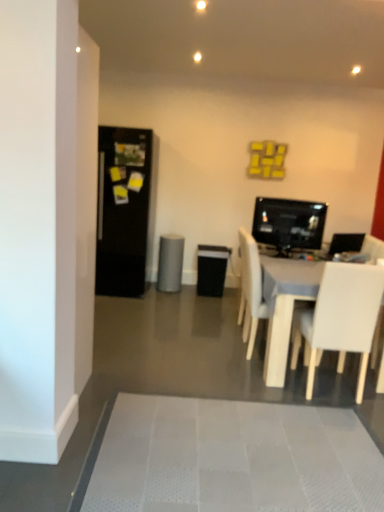
Locate an element on the screen. The width and height of the screenshot is (384, 512). black matte refrigerator at left is located at coordinates (124, 209).

What is the approximate width of black matte refrigerator at left?

black matte refrigerator at left is 31.75 inches in width.

Measure the distance between point (x=282, y=273) and camera.

The distance of point (x=282, y=273) from camera is 3.00 meters.

At what (x,y) coordinates should I click in order to perform the action: click on gray matte speaker at center. Please return your answer as a coordinate pair (x, y). The height and width of the screenshot is (512, 384). Looking at the image, I should click on (170, 263).

In order to face white matte chair at center, the second chair viewed from the front, should I rotate leftwards or rightwards?

To face it directly, rotate right by 11.208 degrees.

Locate an element on the screen. This screenshot has width=384, height=512. white textured bath mat at lower center is located at coordinates (229, 458).

Find the location of a particular element. matte black monitor at center right is located at coordinates (288, 225).

What do you see at coordinates (340, 319) in the screenshot? I see `white matte chair at lower right, acting as the 2th chair starting from the back` at bounding box center [340, 319].

Image resolution: width=384 pixels, height=512 pixels. Identify the location of black matte refrigerator at left. (124, 209).

Can you confirm if white plastic entertainment center at lower right is taller than white matte chair at lower right, marked as the first chair in a front-to-back arrangement?

No.

Can you confirm if white plastic entertainment center at lower right is wider than white matte chair at lower right, marked as the first chair in a front-to-back arrangement?

Yes.

Is white plastic entertainment center at lower right smaller than white matte chair at lower right, acting as the 2th chair starting from the back?

No, white plastic entertainment center at lower right is not smaller than white matte chair at lower right, acting as the 2th chair starting from the back.

From a real-world perspective, is black matte refrigerator at left located higher than white matte chair at lower right, marked as the first chair in a front-to-back arrangement?

Yes, from a real-world perspective, black matte refrigerator at left is above white matte chair at lower right, marked as the first chair in a front-to-back arrangement.

Is there a large distance between black matte refrigerator at left and white matte chair at lower right, acting as the 2th chair starting from the back?

Yes.

In terms of width, does black matte refrigerator at left look wider or thinner when compared to white matte chair at lower right, acting as the 2th chair starting from the back?

black matte refrigerator at left is wider than white matte chair at lower right, acting as the 2th chair starting from the back.

Which point is more distant from viewer, [357,264] or [263,230]?

The point [263,230] is farther.

Is white matte chair at lower right, acting as the 2th chair starting from the back, facing towards matte black monitor at center right?

Yes, white matte chair at lower right, acting as the 2th chair starting from the back, is facing matte black monitor at center right.

Who is more distant, white matte chair at lower right, marked as the first chair in a front-to-back arrangement, or matte black monitor at center right?

Positioned behind is matte black monitor at center right.

Is matte black monitor at center right placed right next to gray matte speaker at center?

matte black monitor at center right is not next to gray matte speaker at center, and they're not touching.

Is matte black monitor at center right thinner than gray matte speaker at center?

Yes.

What's the angular difference between matte black monitor at center right and gray matte speaker at center's facing directions?

14.7 degrees.

Can you confirm if matte black monitor at center right is bigger than gray matte speaker at center?

No, matte black monitor at center right is not bigger than gray matte speaker at center.

Is white plastic entertainment center at lower right inside or outside of black matte refrigerator at left?

white plastic entertainment center at lower right is outside black matte refrigerator at left.

From the picture: Who is smaller, white plastic entertainment center at lower right or black matte refrigerator at left?

Smaller between the two is black matte refrigerator at left.

Looking at this image, does white plastic entertainment center at lower right have a greater width compared to black matte refrigerator at left?

Yes, white plastic entertainment center at lower right is wider than black matte refrigerator at left.

Is white plastic entertainment center at lower right next to black matte refrigerator at left and touching it?

No, white plastic entertainment center at lower right is not making contact with black matte refrigerator at left.

Locate an element on the screen. The width and height of the screenshot is (384, 512). entertainment center on the right of white matte chair at center, the first chair when ordered from back to front is located at coordinates (285, 307).

Considering the sizes of white plastic entertainment center at lower right and white matte chair at center, the first chair when ordered from back to front, in the image, is white plastic entertainment center at lower right wider or thinner than white matte chair at center, the first chair when ordered from back to front,?

Clearly, white plastic entertainment center at lower right has more width compared to white matte chair at center, the first chair when ordered from back to front.

Looking at this image, is white plastic entertainment center at lower right spatially inside white matte chair at center, the second chair viewed from the front, or outside of it?

white plastic entertainment center at lower right is spatially situated outside white matte chair at center, the second chair viewed from the front.

Which of these two, white plastic entertainment center at lower right or white matte chair at center, the first chair when ordered from back to front, is bigger?

Bigger between the two is white plastic entertainment center at lower right.

Is white textured bath mat at lower center turned away from matte black monitor at center right?

white textured bath mat at lower center does not have its back to matte black monitor at center right.

Is point (271, 493) positioned after point (293, 234)?

No, (271, 493) is in front of (293, 234).

Looking at this image, is white textured bath mat at lower center at the right side of matte black monitor at center right?

In fact, white textured bath mat at lower center is to the left of matte black monitor at center right.

In the scene shown: From a real-world perspective, is white textured bath mat at lower center on matte black monitor at center right?

Actually, white textured bath mat at lower center is physically below matte black monitor at center right in the real world.

In order to click on chair in front of the white plastic entertainment center at lower right in this screenshot , I will do `click(340, 319)`.

Where is `the 2nd chair to the right of the black matte refrigerator at left, counting from the anchor's position`? The image size is (384, 512). the 2nd chair to the right of the black matte refrigerator at left, counting from the anchor's position is located at coordinates (340, 319).

Which object lies further to the anchor point white textured bath mat at lower center, matte black monitor at center right or white matte chair at center, the first chair when ordered from back to front?

matte black monitor at center right is further to white textured bath mat at lower center.

From the image, which object appears to be nearer to white matte chair at center, the second chair viewed from the front, matte black monitor at center right or white matte chair at lower right, marked as the first chair in a front-to-back arrangement?

Among the two, matte black monitor at center right is located nearer to white matte chair at center, the second chair viewed from the front.

From the image, which object appears to be farther from matte black monitor at center right, white matte chair at center, the second chair viewed from the front, or white matte chair at lower right, marked as the first chair in a front-to-back arrangement?

white matte chair at lower right, marked as the first chair in a front-to-back arrangement, is further to matte black monitor at center right.

Based on their spatial positions, is matte black monitor at center right or white plastic entertainment center at lower right closer to black matte refrigerator at left?

The object closer to black matte refrigerator at left is matte black monitor at center right.

Considering their positions, is white plastic entertainment center at lower right positioned further to gray matte speaker at center than matte black monitor at center right?

white plastic entertainment center at lower right.

Looking at the image, which one is located further to white matte chair at lower right, marked as the first chair in a front-to-back arrangement, white plastic entertainment center at lower right or white matte chair at center, the first chair when ordered from back to front?

white matte chair at center, the first chair when ordered from back to front.

Looking at the image, which one is located closer to white matte chair at lower right, acting as the 2th chair starting from the back, black matte refrigerator at left or white plastic entertainment center at lower right?

Based on the image, white plastic entertainment center at lower right appears to be nearer to white matte chair at lower right, acting as the 2th chair starting from the back.

Considering their positions, is white matte chair at center, the second chair viewed from the front, positioned further to black matte refrigerator at left than white matte chair at lower right, marked as the first chair in a front-to-back arrangement?

white matte chair at lower right, marked as the first chair in a front-to-back arrangement.

Identify the location of chair positioned between white matte chair at lower right, acting as the 2th chair starting from the back, and gray matte speaker at center from near to far. (251, 291).

Identify the location of computer monitor between black matte refrigerator at left and white matte chair at lower right, acting as the 2th chair starting from the back. (288, 225).

You are a GUI agent. You are given a task and a screenshot of the screen. Output one action in this format:
    pyautogui.click(x=<x>, y=<y>)
    Task: Click on the chair located between white matte chair at lower right, acting as the 2th chair starting from the back, and matte black monitor at center right in the depth direction
    This screenshot has width=384, height=512.
    Given the screenshot: What is the action you would take?
    pyautogui.click(x=251, y=291)

This screenshot has width=384, height=512. Identify the location of computer monitor between white matte chair at center, the second chair viewed from the front, and gray matte speaker at center, along the z-axis. coord(288,225).